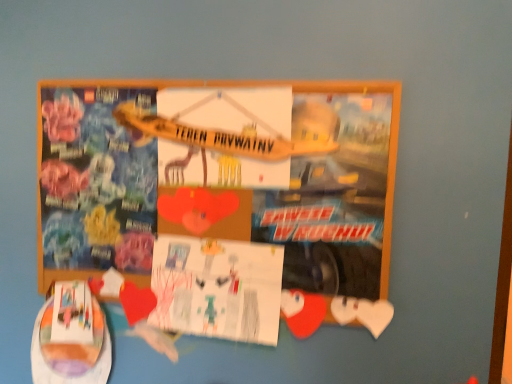
Question: Considering their positions, is white paper at center located in front of or behind matte cardboard poster at center?

Choices:
 (A) front
 (B) behind

Answer: (B)

Question: Looking at their shapes, would you say white paper at center is wider or thinner than matte cardboard poster at center?

Choices:
 (A) wide
 (B) thin

Answer: (B)

Question: From a real-world perspective, is white paper at center positioned above or below matte cardboard poster at center?

Choices:
 (A) above
 (B) below

Answer: (B)

Question: Is point (312, 304) positioned closer to the camera than point (174, 306)?

Choices:
 (A) closer
 (B) farther

Answer: (A)

Question: Is matte cardboard poster at center in front of or behind white paper at center in the image?

Choices:
 (A) behind
 (B) front

Answer: (B)

Question: From their relative heights in the image, would you say matte cardboard poster at center is taller or shorter than white paper at center?

Choices:
 (A) short
 (B) tall

Answer: (B)

Question: Would you say matte cardboard poster at center is to the left or to the right of white paper at center in the picture?

Choices:
 (A) right
 (B) left

Answer: (B)